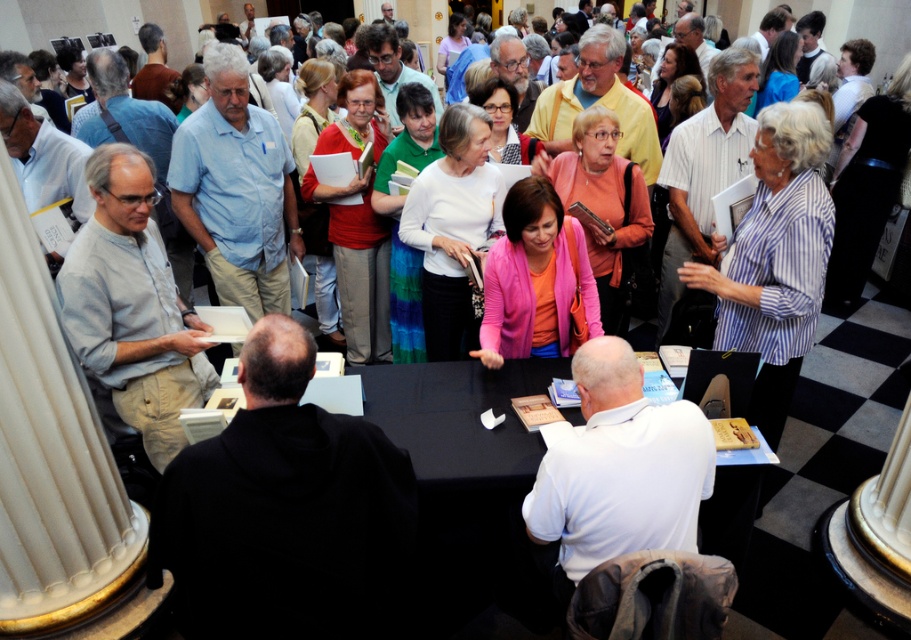
Question: Does black fabric table at center appear on the left side of white matte sweater at center?

Choices:
 (A) no
 (B) yes

Answer: (B)

Question: Does striped cotton shirt at center have a lesser width compared to pink matte sweater at center?

Choices:
 (A) no
 (B) yes

Answer: (A)

Question: Does white cotton shirt at center appear on the right side of pink matte sweater at center?

Choices:
 (A) no
 (B) yes

Answer: (B)

Question: Which of these objects is positioned farthest from the black hoodie at center?

Choices:
 (A) pink matte sweater at center
 (B) gray cotton shirt at left
 (C) striped cotton shirt at center

Answer: (C)

Question: Estimate the real-world distances between objects in this image. Which object is farther from the pink matte sweater at center?

Choices:
 (A) gray cotton shirt at left
 (B) black hoodie at center

Answer: (A)

Question: Which point is farther to the camera?

Choices:
 (A) [487, 321]
 (B) [621, 374]

Answer: (A)